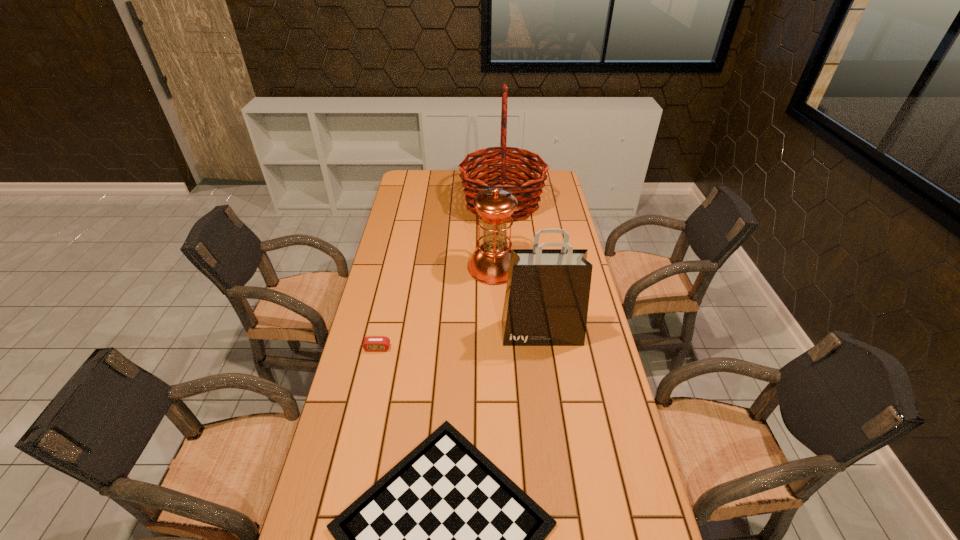
Where is `free space between the shopping bag and the alarm clock`? The width and height of the screenshot is (960, 540). free space between the shopping bag and the alarm clock is located at coordinates (460, 340).

Image resolution: width=960 pixels, height=540 pixels. Identify the location of object that is the second closest to the alarm clock. (546, 302).

You are a GUI agent. You are given a task and a screenshot of the screen. Output one action in this format:
    pyautogui.click(x=<x>, y=<y>)
    Task: Click on the second closest object to the shopping bag
    
    Given the screenshot: What is the action you would take?
    pyautogui.click(x=445, y=539)

In order to click on free location that satisfies the following two spatial constraints: 1. on the back side of the fourth nearest object; 2. on the left side of the farthest object in this screenshot , I will do `click(492, 203)`.